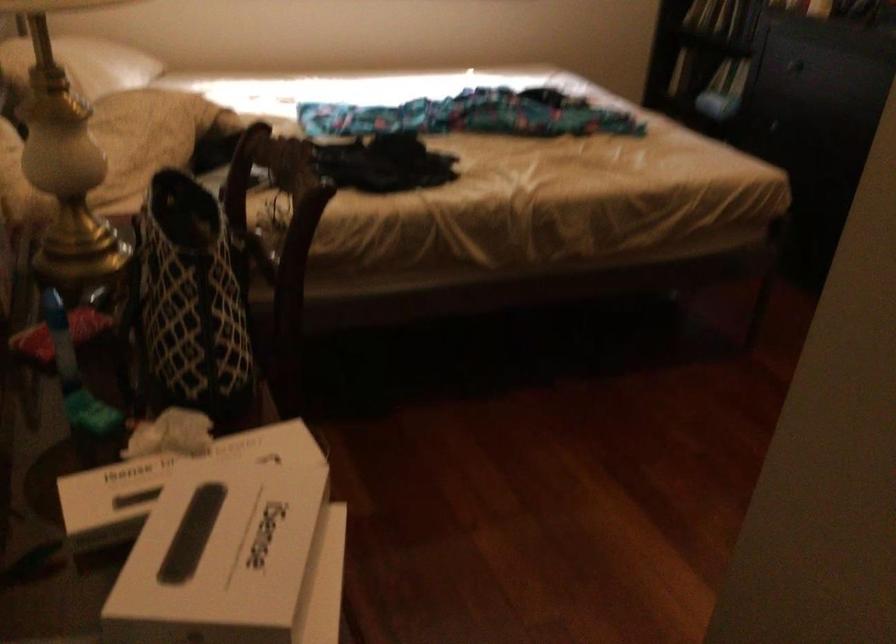
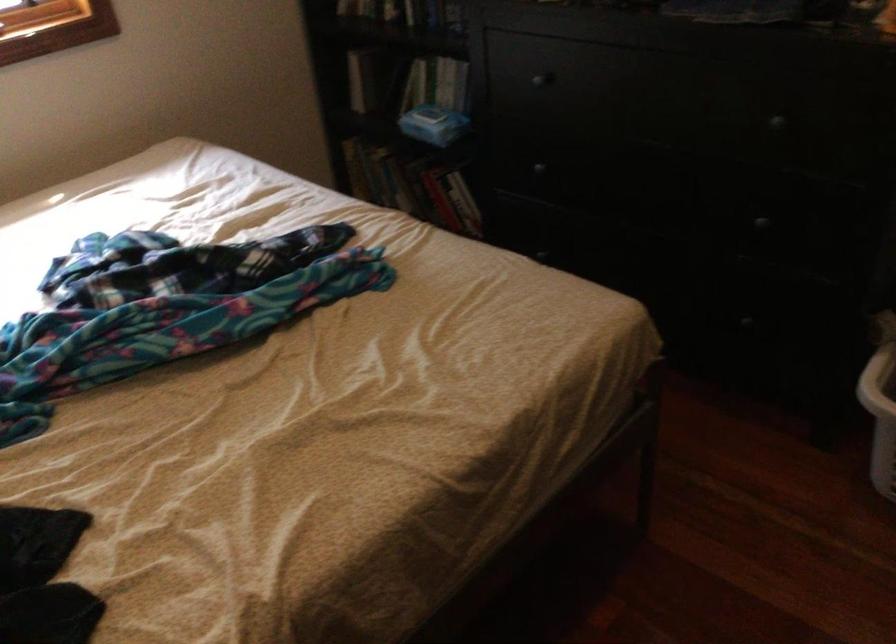
Where in the second image is the point corresponding to point (708, 138) from the first image?

(418, 187)